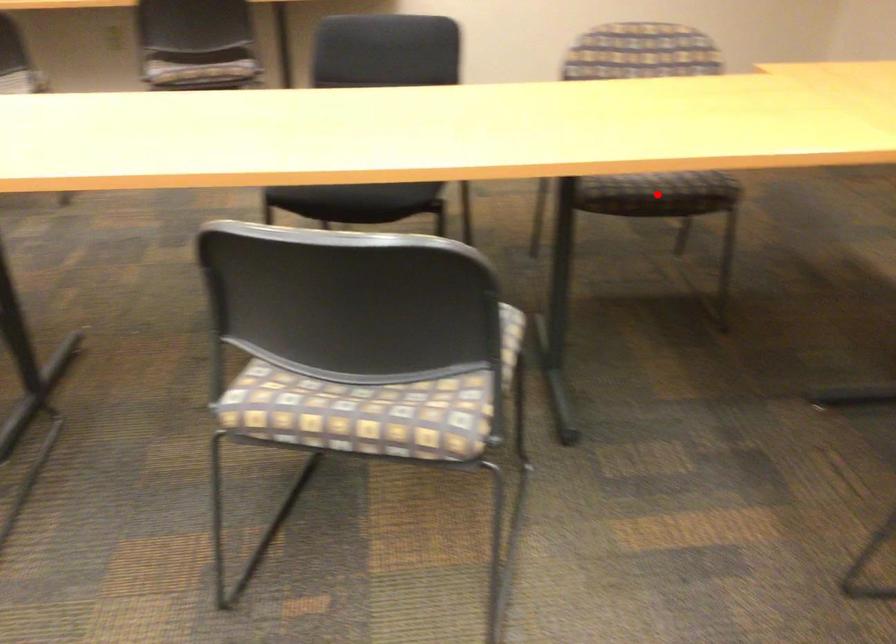
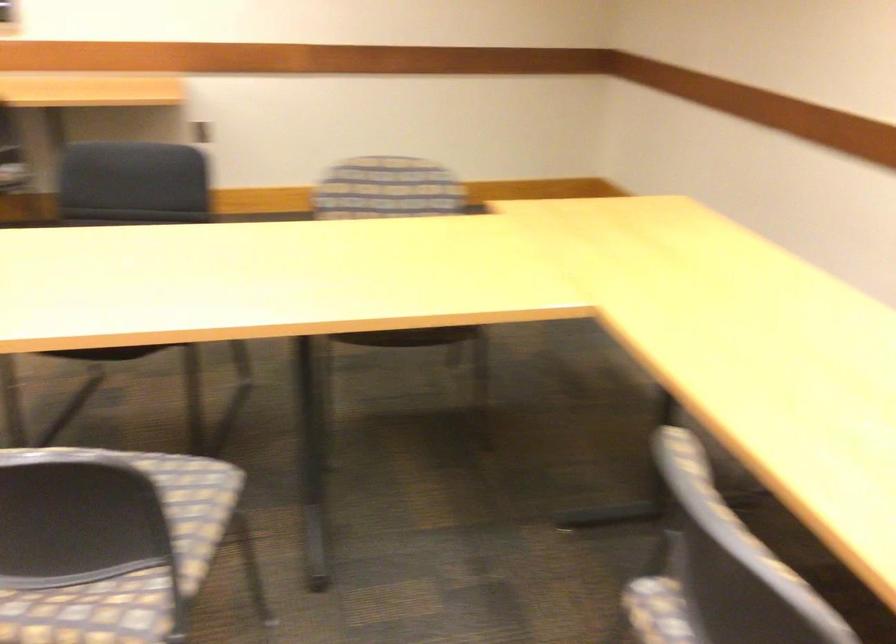
Question: I am providing you with two images of the same scene from different viewpoints. A red point is marked on the first image. Can you still see the location of the red point in image 2?

Choices:
 (A) Yes
 (B) No

Answer: (B)